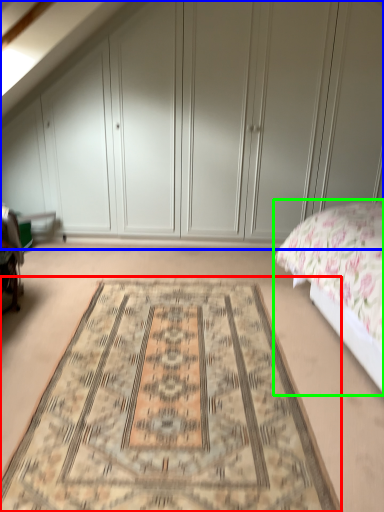
Question: Considering the real-world distances, which object is closest to mat (highlighted by a red box)? dresser (highlighted by a blue box) or bed (highlighted by a green box).

Choices:
 (A) dresser
 (B) bed

Answer: (B)